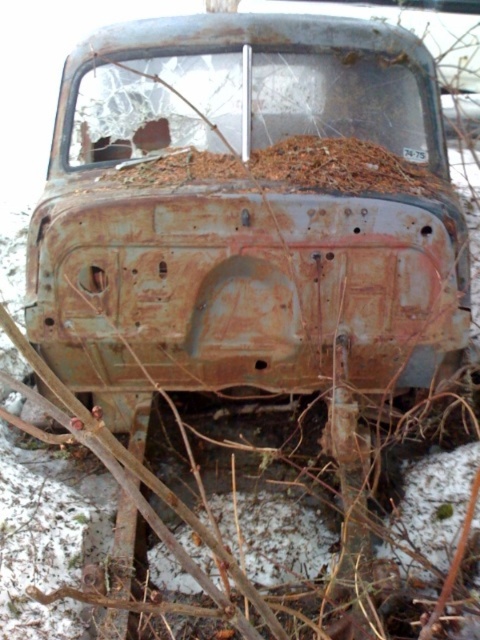
What do you see at coordinates (248, 214) in the screenshot? I see `rusty metal car at center` at bounding box center [248, 214].

Consider the image. Does rusty metal car at center have a greater width compared to rusty metal hood at center?

Yes.

Locate an element on the screen. rusty metal car at center is located at coordinates (248, 214).

Locate an element on the screen. rusty metal car at center is located at coordinates (248, 214).